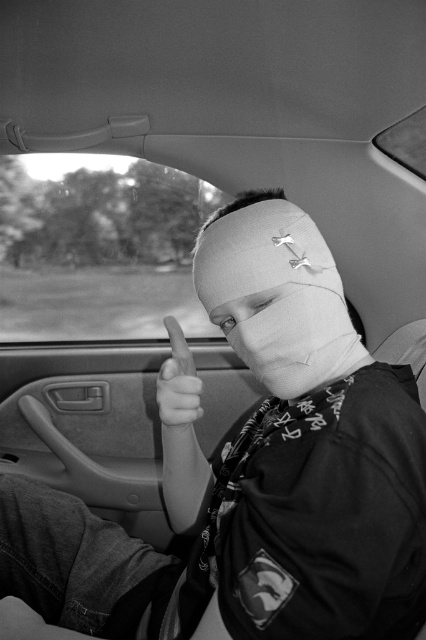
You are a medical professional assessing the visibility of the bandage in the image. The scene shows a person in a car with two bandages labeled as white bandage at center and white matte bandage at center. Which bandage is taller?

The white bandage at center is taller than the white matte bandage at center according to the description.

From the picture: You are standing 3 meters away from the car. You want to reach the point at coordinates point (83, 154). Can you reach it without moving closer?

The distance of point (83, 154) from viewer is 2.52 meters, so you are currently 3 meters away. Since 3 meters is farther than 2.52 meters, you need to move 0.48 meters closer to reach the point.

Based on the scene described, where is the white bandage at center located in the image?

The white bandage at center is located at point (276, 294) in the image.